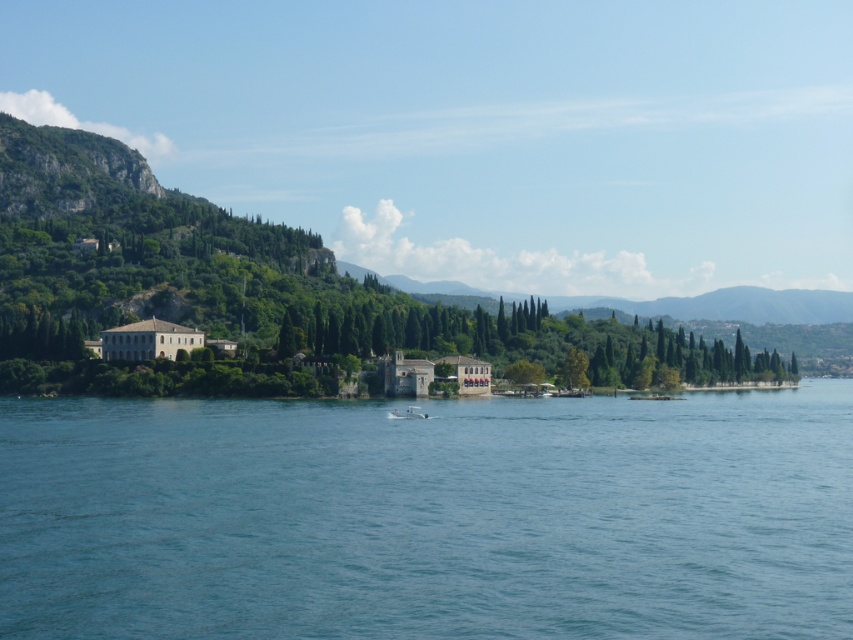
Question: Does blue water at center have a lesser width compared to green leafy tree at center?

Choices:
 (A) no
 (B) yes

Answer: (A)

Question: Can you confirm if blue water at center is positioned below green leafy tree at center?

Choices:
 (A) no
 (B) yes

Answer: (B)

Question: Which object is closer to the camera taking this photo?

Choices:
 (A) white plastic boat at center
 (B) green leafy tree at center
 (C) blue water at center

Answer: (C)

Question: Which of the following is the farthest from the observer?

Choices:
 (A) (540, 493)
 (B) (392, 412)

Answer: (B)

Question: Which point is farther to the camera?

Choices:
 (A) (387, 413)
 (B) (515, 380)

Answer: (B)

Question: Can you confirm if blue water at center is wider than green leafy tree at center?

Choices:
 (A) no
 (B) yes

Answer: (B)